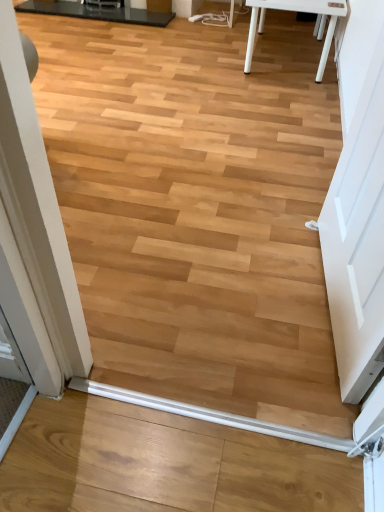
Locate an element on the screen. The image size is (384, 512). white plastic beam at lower center is located at coordinates (210, 415).

Describe the element at coordinates (96, 12) in the screenshot. The image size is (384, 512). I see `black glossy table at upper left` at that location.

The width and height of the screenshot is (384, 512). Identify the location of white plastic beam at lower center. (210, 415).

Which is more to the right, white matte door at right or white plastic beam at lower center?

Positioned to the right is white matte door at right.

Considering the sizes of white matte door at right and white plastic beam at lower center in the image, is white matte door at right wider or thinner than white plastic beam at lower center?

white matte door at right is wider than white plastic beam at lower center.

Would you consider white matte door at right to be distant from white plastic beam at lower center?

They are positioned close to each other.

Is there a large distance between white plastic beam at lower center and black glossy table at upper left?

Yes, white plastic beam at lower center and black glossy table at upper left are quite far apart.

Is white plastic beam at lower center positioned before black glossy table at upper left?

Yes.

Which of these two, white plastic beam at lower center or black glossy table at upper left, stands shorter?

white plastic beam at lower center.

From the image's perspective, is white plastic beam at lower center under black glossy table at upper left?

Yes.

Is black glossy table at upper left facing away from white plastic beam at lower center?

No.

Between black glossy table at upper left and white plastic beam at lower center, which one appears on the right side from the viewer's perspective?

From the viewer's perspective, white plastic beam at lower center appears more on the right side.

From a real-world perspective, is black glossy table at upper left below white plastic beam at lower center?

Actually, black glossy table at upper left is physically above white plastic beam at lower center in the real world.

From the image's perspective, relative to white plastic beam at lower center, is black glossy table at upper left above or below?

From the image's perspective, black glossy table at upper left appears above white plastic beam at lower center.

Between black glossy table at upper left and white matte door at right, which one has more height?

white matte door at right is taller.

From a real-world perspective, is black glossy table at upper left physically located above or below white matte door at right?

From a real-world perspective, black glossy table at upper left is physically below white matte door at right.

How much distance is there between black glossy table at upper left and white matte door at right?

black glossy table at upper left and white matte door at right are 2.92 meters apart from each other.

Looking at the image, does black glossy table at upper left seem bigger or smaller compared to white matte door at right?

Considering their sizes, black glossy table at upper left takes up less space than white matte door at right.

Consider the image. Is white matte door at right bigger than black glossy table at upper left?

Yes, white matte door at right is bigger than black glossy table at upper left.

Could you tell me if white matte door at right is turned towards black glossy table at upper left?

No.

Based on the photo, from the image's perspective, is white matte door at right on top of black glossy table at upper left?

No, from the image's perspective, white matte door at right is not over black glossy table at upper left.

From the image's perspective, is white plastic beam at lower center above white matte door at right?

Incorrect, from the image's perspective, white plastic beam at lower center is lower than white matte door at right.

Is white plastic beam at lower center bigger or smaller than white matte door at right?

Considering their sizes, white plastic beam at lower center takes up less space than white matte door at right.

From a real-world perspective, is white plastic beam at lower center below white matte door at right?

Yes, from a real-world perspective, white plastic beam at lower center is below white matte door at right.

Considering the positions of points (248, 424) and (356, 228), is point (248, 424) farther from camera compared to point (356, 228)?

No.

The image size is (384, 512). In order to click on screen door above the white plastic beam at lower center (from a real-world perspective) in this screenshot , I will do `click(357, 245)`.

You are a GUI agent. You are given a task and a screenshot of the screen. Output one action in this format:
    pyautogui.click(x=<x>, y=<y>)
    Task: Click on the beam in front of the black glossy table at upper left
    This screenshot has width=384, height=512.
    Given the screenshot: What is the action you would take?
    pyautogui.click(x=210, y=415)

When comparing their distances from white matte door at right, does black glossy table at upper left or white plastic beam at lower center seem further?

The object further to white matte door at right is black glossy table at upper left.

Consider the image. Looking at the image, which one is located closer to black glossy table at upper left, white matte door at right or white plastic beam at lower center?

white matte door at right lies closer to black glossy table at upper left than the other object.

Based on the photo, considering their positions, is white matte door at right positioned closer to white plastic beam at lower center than black glossy table at upper left?

white matte door at right lies closer to white plastic beam at lower center than the other object.

From the image, which object appears to be farther from black glossy table at upper left, white plastic beam at lower center or white matte door at right?

The object further to black glossy table at upper left is white plastic beam at lower center.

When comparing their distances from white matte door at right, does white plastic beam at lower center or black glossy table at upper left seem further?

black glossy table at upper left is further to white matte door at right.

Which object lies nearer to the anchor point white plastic beam at lower center, black glossy table at upper left or white matte door at right?

white matte door at right is closer to white plastic beam at lower center.

Where is `beam between white matte door at right and black glossy table at upper left in the front-back direction`? beam between white matte door at right and black glossy table at upper left in the front-back direction is located at coordinates (210, 415).